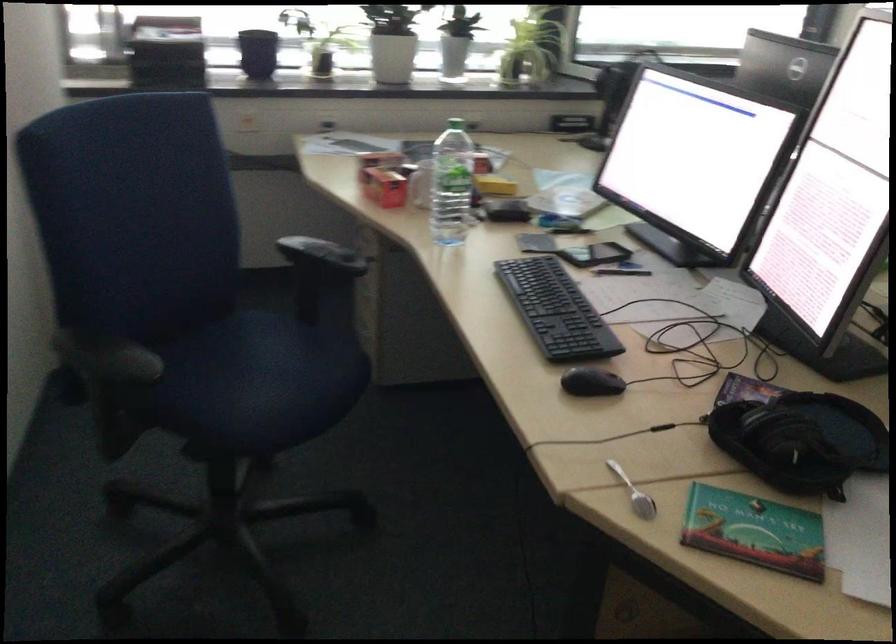
This screenshot has width=896, height=644. I want to click on green bottle cap, so click(x=455, y=126).